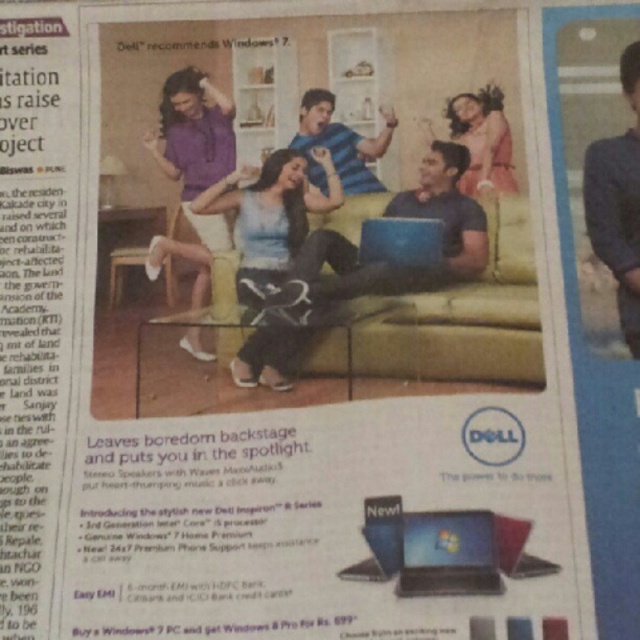
Is blue matte laptop at center to the right of blue striped shirt at center from the viewer's perspective?

Yes, blue matte laptop at center is to the right of blue striped shirt at center.

Between point (472, 268) and point (332, 106), which one is positioned in front?

Point (472, 268)

You are a GUI agent. You are given a task and a screenshot of the screen. Output one action in this format:
    pyautogui.click(x=<x>, y=<y>)
    Task: Click on the blue matte laptop at center
    This screenshot has height=640, width=640.
    Given the screenshot: What is the action you would take?
    pyautogui.click(x=356, y=269)

How far apart are black glossy laptop at lower center and matte black laptop at lower right?

black glossy laptop at lower center and matte black laptop at lower right are 1.22 inches apart from each other.

Who is higher up, black glossy laptop at lower center or matte black laptop at lower right?

Positioned higher is black glossy laptop at lower center.

Does point (470, 515) come closer to viewer compared to point (497, 556)?

No, it is not.

Find the location of `black glossy laptop at lower center`. black glossy laptop at lower center is located at coordinates (449, 554).

The image size is (640, 640). What do you see at coordinates (339, 144) in the screenshot? I see `blue striped shirt at center` at bounding box center [339, 144].

Find the location of a particular element. The image size is (640, 640). blue striped shirt at center is located at coordinates (339, 144).